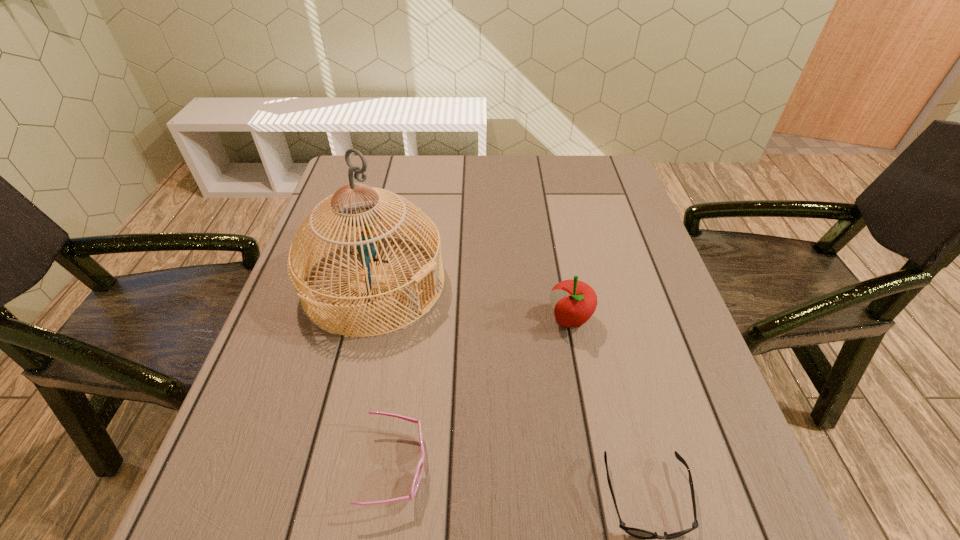
Where is `free space at the near edge of the desktop`? The height and width of the screenshot is (540, 960). free space at the near edge of the desktop is located at coordinates (348, 525).

Where is `free space at the left edge`? The image size is (960, 540). free space at the left edge is located at coordinates (288, 306).

Find the location of `vacant space at the right edge of the desktop`. vacant space at the right edge of the desktop is located at coordinates (617, 216).

The image size is (960, 540). I want to click on vacant space at the far left corner, so click(386, 160).

In the image, there is a desktop. Where is `vacant space at the far right corner`? The image size is (960, 540). vacant space at the far right corner is located at coordinates (618, 165).

This screenshot has width=960, height=540. In the image, there is a desktop. Find the location of `free region at the near right corner`. free region at the near right corner is located at coordinates (713, 537).

I want to click on free spot between the third tallest object and the tallest object, so (x=385, y=375).

Locate an element on the screen. Image resolution: width=960 pixels, height=540 pixels. vacant space in between the apple and the third tallest object is located at coordinates (483, 393).

Find the location of a particular element. This screenshot has width=960, height=540. unoccupied position between the third shortest object and the left sunglasses is located at coordinates (483, 393).

Find the location of a particular element. unoccupied area between the tallest object and the taller sunglasses is located at coordinates (385, 375).